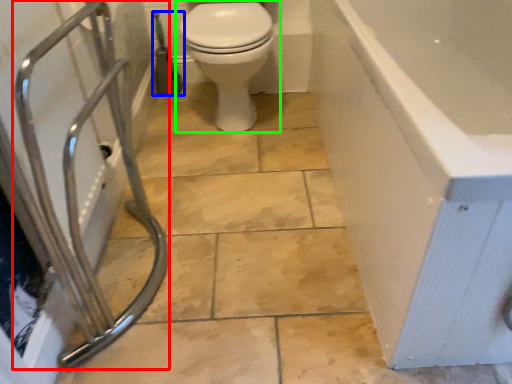
Question: Which object is positioned closest to shower (highlighted by a red box)? Select from garden hose (highlighted by a blue box) and toilet (highlighted by a green box).

Choices:
 (A) garden hose
 (B) toilet

Answer: (B)